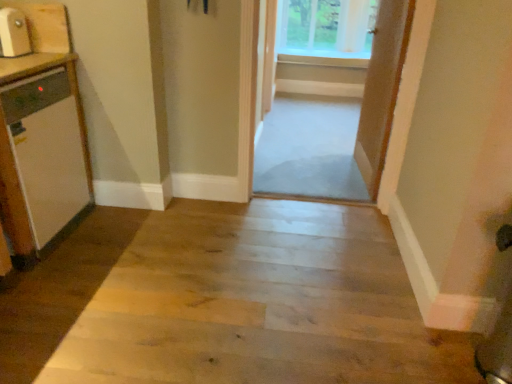
Question: Considering the relative sizes of wooden door at center, which is the 1th door in left-to-right order, and white glossy dishwasher at left, positioned as the 1th appliance in bottom-to-top order, in the image provided, is wooden door at center, which is the 1th door in left-to-right order, smaller than white glossy dishwasher at left, positioned as the 1th appliance in bottom-to-top order,?

Choices:
 (A) no
 (B) yes

Answer: (B)

Question: Considering the relative positions of wooden door at center, which is the 1th door in left-to-right order, and white glossy dishwasher at left, which is the second appliance from top to bottom, in the image provided, is wooden door at center, which is the 1th door in left-to-right order, to the left of white glossy dishwasher at left, which is the second appliance from top to bottom, from the viewer's perspective?

Choices:
 (A) yes
 (B) no

Answer: (B)

Question: Could you tell me if wooden door at center, which appears as the first door when viewed from the back, is turned towards white glossy dishwasher at left, positioned as the 1th appliance in bottom-to-top order?

Choices:
 (A) no
 (B) yes

Answer: (A)

Question: From a real-world perspective, does wooden door at center, which is counted as the 2th door, starting from the right, sit lower than white glossy dishwasher at left, which is the second appliance from top to bottom?

Choices:
 (A) yes
 (B) no

Answer: (B)

Question: Is wooden door at center, the second door positioned from the front, facing away from white glossy dishwasher at left, which is the second appliance from top to bottom?

Choices:
 (A) yes
 (B) no

Answer: (B)

Question: Is wooden door at center, which is the 1th door in left-to-right order, taller than white glossy dishwasher at left, positioned as the 1th appliance in bottom-to-top order?

Choices:
 (A) yes
 (B) no

Answer: (A)

Question: Can you confirm if clear glass window at upper center is smaller than wooden floor at center?

Choices:
 (A) no
 (B) yes

Answer: (B)

Question: Does clear glass window at upper center appear on the right side of wooden floor at center?

Choices:
 (A) no
 (B) yes

Answer: (B)

Question: Is clear glass window at upper center turned away from wooden floor at center?

Choices:
 (A) no
 (B) yes

Answer: (A)

Question: Is clear glass window at upper center positioned beyond the bounds of wooden floor at center?

Choices:
 (A) no
 (B) yes

Answer: (B)

Question: Is clear glass window at upper center thinner than wooden floor at center?

Choices:
 (A) yes
 (B) no

Answer: (A)

Question: Considering the relative positions of clear glass window at upper center and wooden floor at center in the image provided, is clear glass window at upper center to the left of wooden floor at center from the viewer's perspective?

Choices:
 (A) no
 (B) yes

Answer: (A)

Question: Considering the relative sizes of wooden floor at center and white glossy dishwasher at left, positioned as the 1th appliance in bottom-to-top order, in the image provided, is wooden floor at center taller than white glossy dishwasher at left, positioned as the 1th appliance in bottom-to-top order,?

Choices:
 (A) yes
 (B) no

Answer: (B)